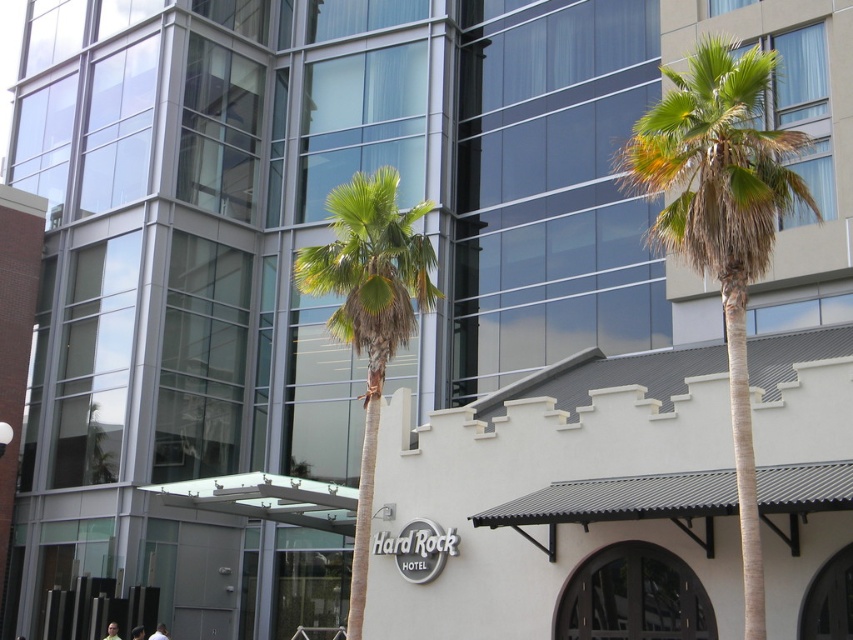
Who is lower down, green leafy palm tree at right or green leafy palm tree at center?

Positioned lower is green leafy palm tree at center.

Between green leafy palm tree at right and green leafy palm tree at center, which one has more height?

Standing taller between the two is green leafy palm tree at right.

Between point (706, 129) and point (339, 264), which one is positioned in front?

Point (706, 129) is in front.

Identify the location of green leafy palm tree at right. (721, 220).